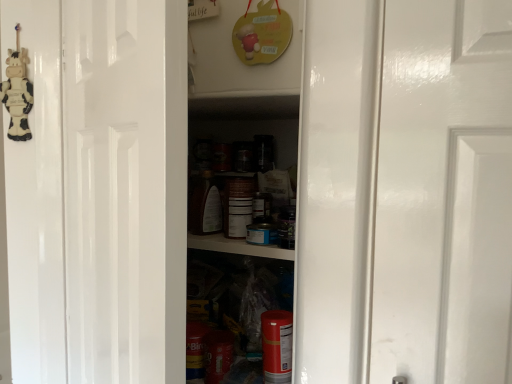
The image size is (512, 384). Describe the element at coordinates (99, 192) in the screenshot. I see `glossy white door at center` at that location.

You are a GUI agent. You are given a task and a screenshot of the screen. Output one action in this format:
    pyautogui.click(x=<x>, y=<y>)
    Task: Click on the glossy white door at center
    This screenshot has height=384, width=512.
    Given the screenshot: What is the action you would take?
    pyautogui.click(x=99, y=192)

The height and width of the screenshot is (384, 512). Identify the location of cow-patterned plush at left. (17, 95).

What do you see at coordinates (17, 95) in the screenshot? This screenshot has width=512, height=384. I see `cow-patterned plush at left` at bounding box center [17, 95].

Find the location of a particular element. glossy white door at center is located at coordinates (99, 192).

Considering the relative positions of glossy white door at center and cow-patterned plush at left in the image provided, is glossy white door at center to the left of cow-patterned plush at left from the viewer's perspective?

No.

Is the position of glossy white door at center more distant than that of cow-patterned plush at left?

That is False.

Is point (152, 97) more distant than point (24, 105)?

No, it is in front of (24, 105).

From the image's perspective, is glossy white door at center located beneath cow-patterned plush at left?

Correct, glossy white door at center appears lower than cow-patterned plush at left in the image.

From a real-world perspective, between glossy white door at center and cow-patterned plush at left, who is vertically higher?

In real-world perspective, cow-patterned plush at left is above.

Between glossy white door at center and cow-patterned plush at left, which one has smaller width?

cow-patterned plush at left is thinner.

From their relative heights in the image, would you say glossy white door at center is taller or shorter than cow-patterned plush at left?

Considering their sizes, glossy white door at center has more height than cow-patterned plush at left.

Which of these two, glossy white door at center or cow-patterned plush at left, is bigger?

glossy white door at center.

Would you say cow-patterned plush at left is part of glossy white door at center's contents?

No, cow-patterned plush at left is not inside glossy white door at center.

Is glossy white door at center in contact with cow-patterned plush at left?

No, glossy white door at center is not in contact with cow-patterned plush at left.

Does glossy white door at center turn towards cow-patterned plush at left?

No, glossy white door at center is not facing towards cow-patterned plush at left.

Locate an element on the screen. toy above the glossy white door at center (from a real-world perspective) is located at coordinates (17, 95).

Considering the positions of objects cow-patterned plush at left and glossy white door at center in the image provided, who is more to the left, cow-patterned plush at left or glossy white door at center?

cow-patterned plush at left.

Is cow-patterned plush at left closer to camera compared to glossy white door at center?

No, it is behind glossy white door at center.

Is point (1, 92) closer or farther from the camera than point (67, 128)?

Point (1, 92) is positioned farther from the camera compared to point (67, 128).

From the image's perspective, which one is positioned lower, cow-patterned plush at left or glossy white door at center?

glossy white door at center appears lower in the image.

From a real-world perspective, which is physically below, cow-patterned plush at left or glossy white door at center?

From a 3D spatial view, glossy white door at center is below.

Which of these two, cow-patterned plush at left or glossy white door at center, is wider?

glossy white door at center.

Is cow-patterned plush at left shorter than glossy white door at center?

Correct, cow-patterned plush at left is not as tall as glossy white door at center.

Does cow-patterned plush at left have a smaller size compared to glossy white door at center?

Yes.

Is cow-patterned plush at left positioned beyond the bounds of glossy white door at center?

cow-patterned plush at left lies outside glossy white door at center's area.

Is cow-patterned plush at left next to glossy white door at center and touching it?

cow-patterned plush at left and glossy white door at center are not in contact.

Looking at this image, could you tell me if cow-patterned plush at left is facing glossy white door at center?

No, cow-patterned plush at left is not aimed at glossy white door at center.

Can you tell me how much cow-patterned plush at left and glossy white door at center differ in facing direction?

31.9 degrees separate the facing orientations of cow-patterned plush at left and glossy white door at center.

This screenshot has height=384, width=512. I want to click on door that is in front of the cow-patterned plush at left, so click(x=99, y=192).

Image resolution: width=512 pixels, height=384 pixels. Identify the location of toy that is above the glossy white door at center (from a real-world perspective). (17, 95).

This screenshot has height=384, width=512. I want to click on toy above the glossy white door at center (from the image's perspective), so click(17, 95).